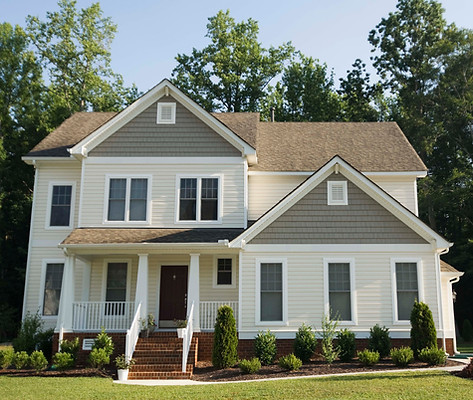
At what (x,y) coordinates should I click in order to perform the action: click on second floor windows. Please return your answer as a coordinate pair (x, y). Looking at the image, I should click on (62, 208), (120, 199), (139, 201), (185, 201), (212, 200).